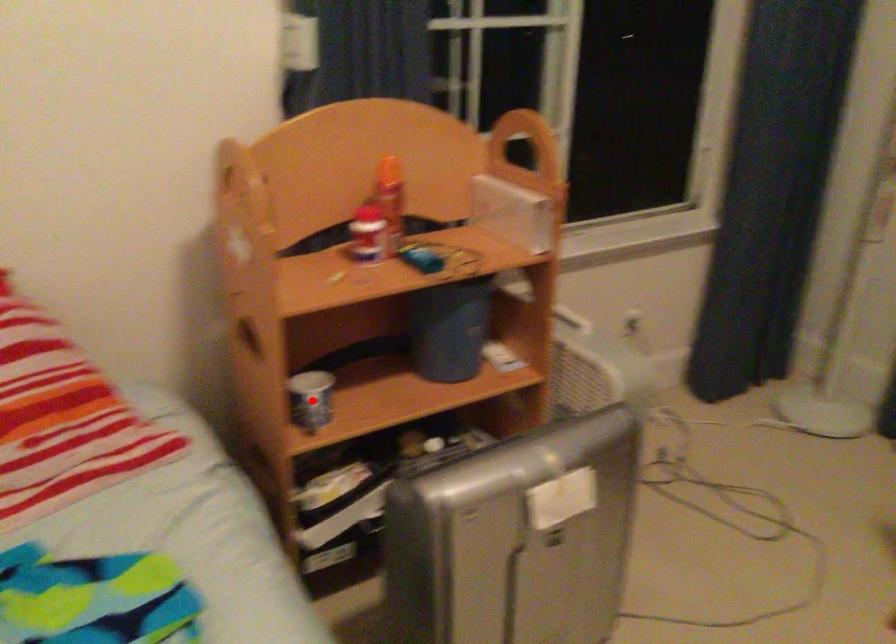
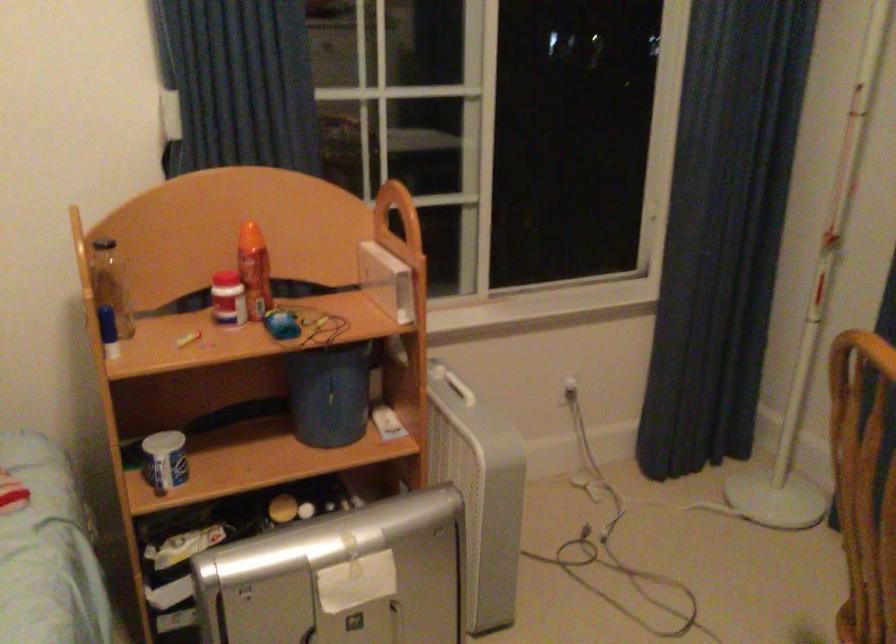
In the second image, find the point that corresponds to the highlighted location in the first image.

(165, 460)